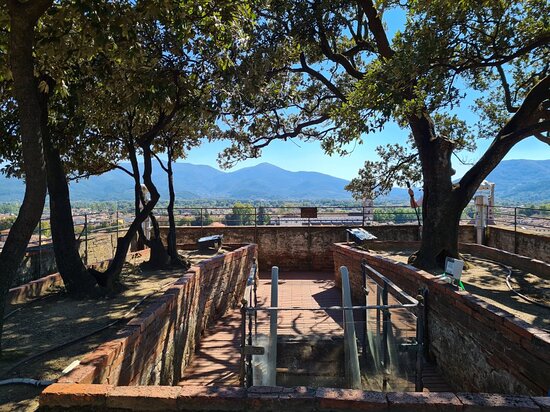
Identify the location of lights. (364, 237), (211, 240).